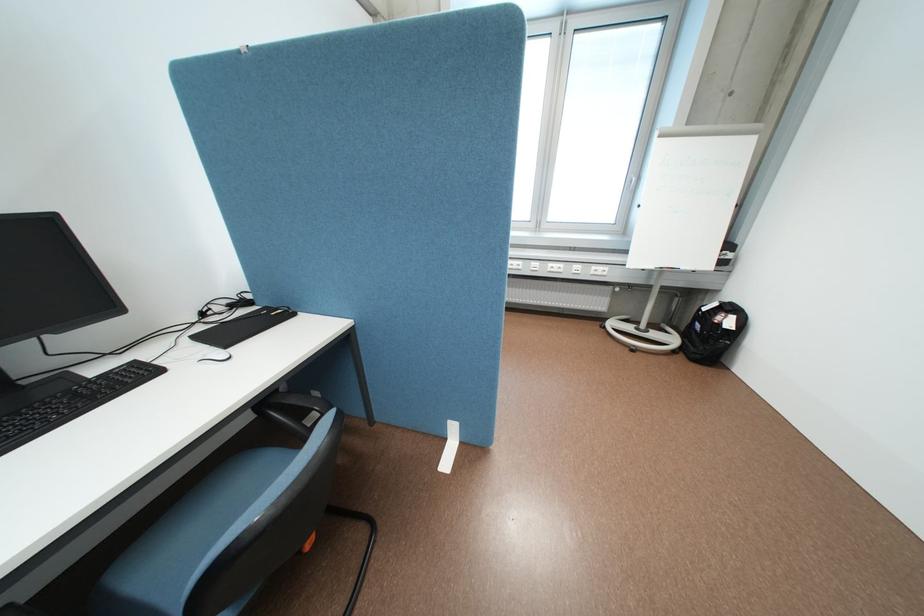
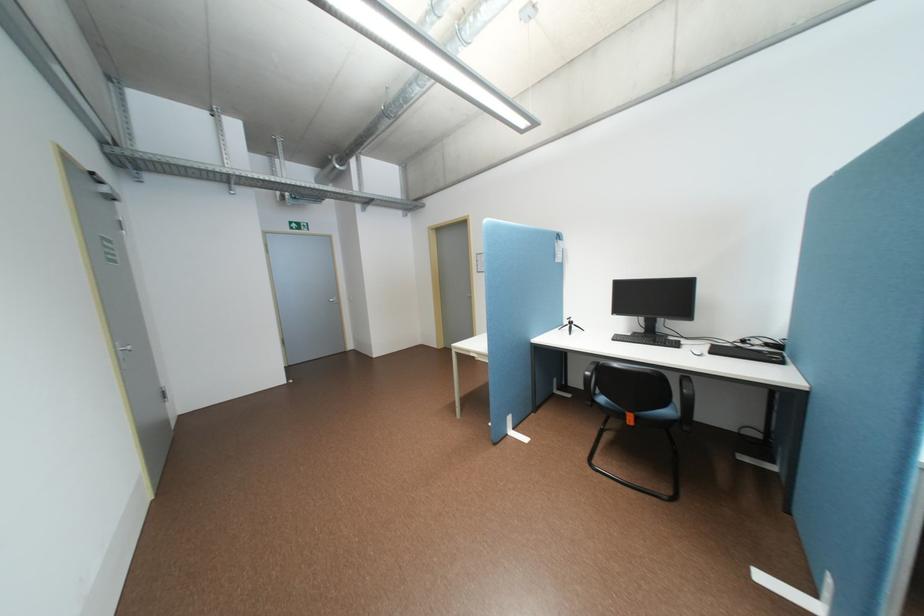
The point at (171, 371) is marked in the first image. Where is the corresponding point in the second image?

(688, 346)